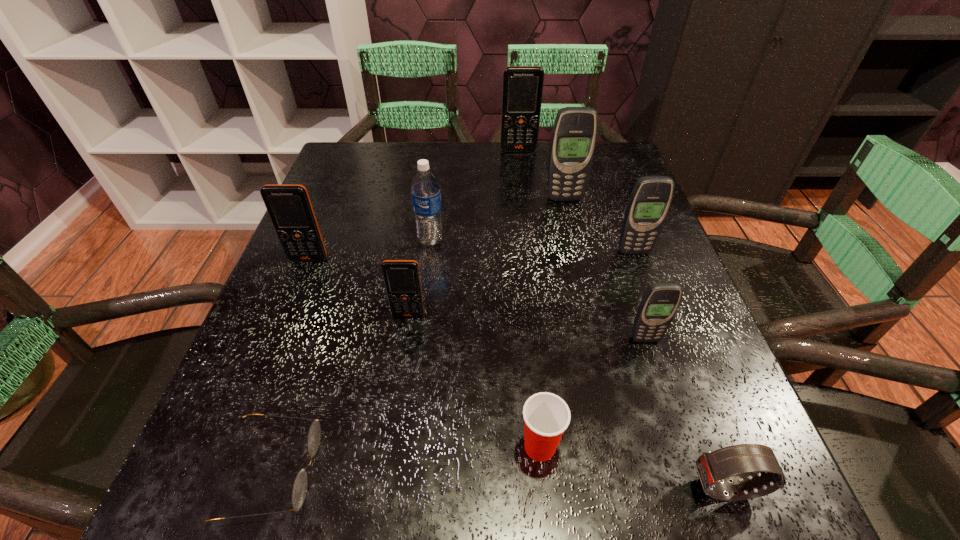
Find the location of a particular element. The image size is (960, 540). Dixie cup that is at the near edge is located at coordinates (546, 416).

Locate an element on the screen. watch at the near edge is located at coordinates (734, 462).

The width and height of the screenshot is (960, 540). Find the location of `spectacles positioned at the near edge`. spectacles positioned at the near edge is located at coordinates (299, 491).

This screenshot has width=960, height=540. In order to click on cellular telephone situated at the left edge in this screenshot , I will do `click(289, 206)`.

This screenshot has width=960, height=540. What are the coordinates of `spectacles located at the left edge` in the screenshot? It's located at coord(299,491).

Image resolution: width=960 pixels, height=540 pixels. In order to click on watch located in the right edge section of the desktop in this screenshot , I will do `click(734, 462)`.

Where is `object at the near left corner`? This screenshot has height=540, width=960. object at the near left corner is located at coordinates (299, 491).

Identify the location of object that is at the near right corner. (734, 462).

I want to click on vacant space at the far edge of the desktop, so click(x=492, y=167).

Identify the location of free point at the near edge. (441, 514).